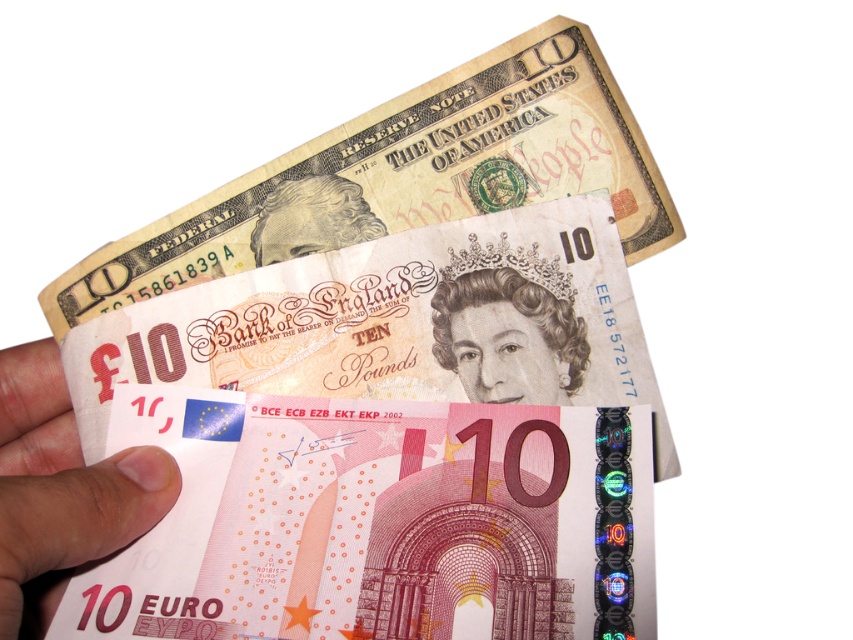
Question: Which of the following is the closest to the observer?

Choices:
 (A) pink paper currency at center
 (B) smooth plastic queen at center
 (C) smooth beige portrait at upper center
 (D) white matte paper at lower left

Answer: (D)

Question: Is pink paper currency at center wider than smooth plastic queen at center?

Choices:
 (A) yes
 (B) no

Answer: (A)

Question: Can you confirm if pink paper currency at center is wider than smooth beige portrait at upper center?

Choices:
 (A) no
 (B) yes

Answer: (B)

Question: Can you confirm if smooth plastic queen at center is positioned to the left of smooth beige portrait at upper center?

Choices:
 (A) no
 (B) yes

Answer: (A)

Question: Which of these objects is positioned closest to the white matte paper at lower left?

Choices:
 (A) pink paper currency at center
 (B) smooth plastic queen at center
 (C) smooth beige portrait at upper center

Answer: (A)

Question: Which object is positioned closest to the smooth plastic queen at center?

Choices:
 (A) white matte paper at lower left
 (B) smooth beige portrait at upper center
 (C) pink paper currency at center

Answer: (C)